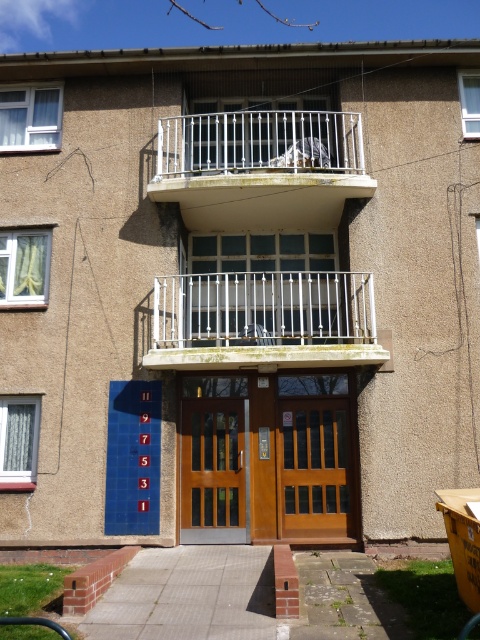
Question: Where is brown wooden door at center located in relation to wooden door at center in the image?

Choices:
 (A) right
 (B) left

Answer: (B)

Question: Which point is closer to the camera?

Choices:
 (A) wooden door at center
 (B) silver metallic balcony at center
 (C) brown wooden door at center

Answer: (B)

Question: Which point is closer to the camera?

Choices:
 (A) silver metallic balcony at center
 (B) brown wooden door at center
 (C) wooden door at center

Answer: (A)

Question: Can you confirm if silver metallic balcony at center is positioned below silver metallic railing at upper center?

Choices:
 (A) yes
 (B) no

Answer: (A)

Question: Is silver metallic balcony at center above silver metallic railing at upper center?

Choices:
 (A) no
 (B) yes

Answer: (A)

Question: Which point is farther to the camera?

Choices:
 (A) (326, 524)
 (B) (238, 360)

Answer: (A)